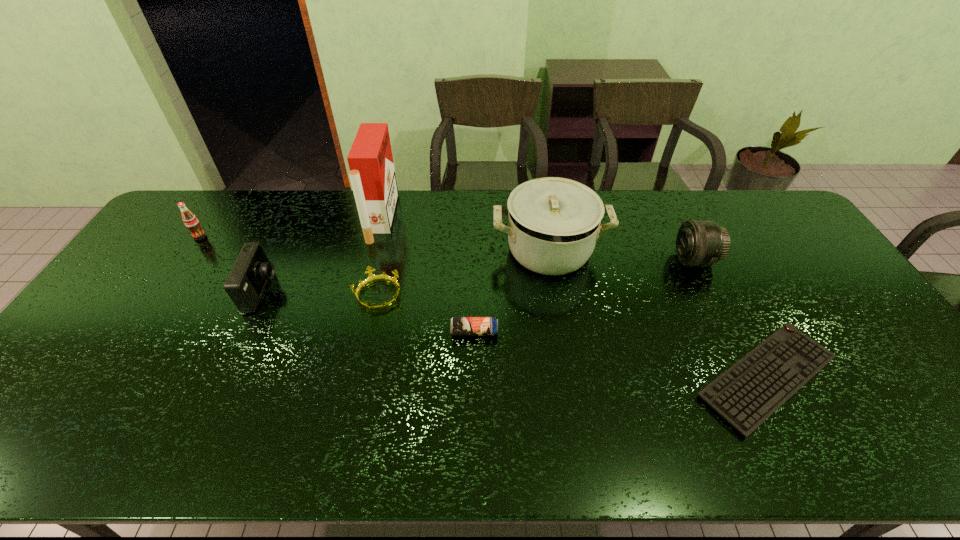
Locate an element on the screen. free space that satisfies the following two spatial constraints: 1. on the front-facing side of the cigarette case; 2. on the right side of the beer can is located at coordinates (353, 332).

Locate an element on the screen. vacant space that satisfies the following two spatial constraints: 1. on the front-facing side of the beer can; 2. on the left side of the camera is located at coordinates (243, 332).